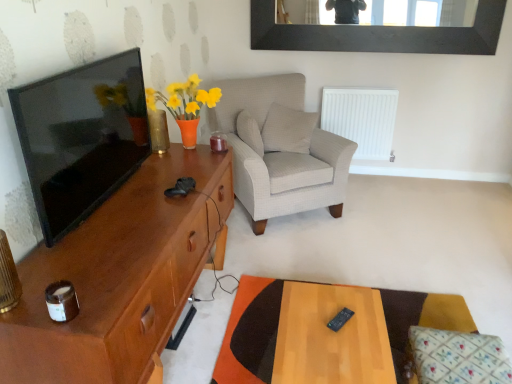
Identify the location of vacant area situated to the left side of black plastic remote at center. pyautogui.click(x=306, y=322).